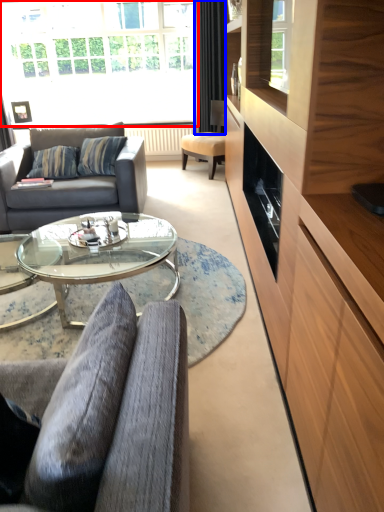
Question: Which of the following is the farthest to the observer, window (highlighted by a red box) or curtain (highlighted by a blue box)?

Choices:
 (A) window
 (B) curtain

Answer: (A)